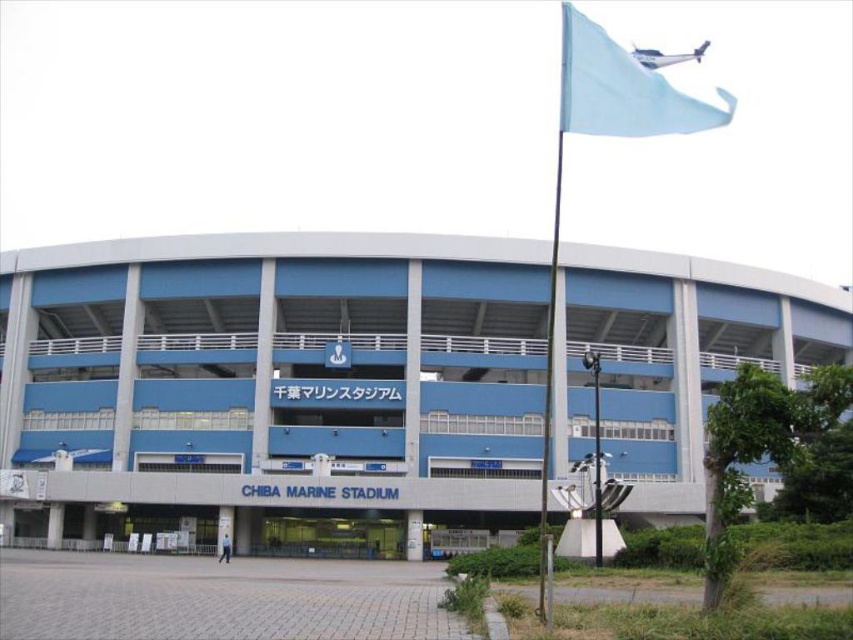
Looking at this image, you are a photographer planning to capture the entire Chiba Marine Stadium and the flag in one shot. Given that your camera can only focus on objects within a 100m width, will the blue concrete stadium at center and the light blue fabric flag at upper right fit in the frame?

The blue concrete stadium at center is wider than the light blue fabric flag at upper right. Since the camera can focus on objects within a 100m width, both objects will fit as long as the total width of the stadium and flag combined does not exceed 100m. However, the description only provides a comparison of their widths, not their exact measurements. Without knowing the exact width of the stadium, it is impossible to determine if they will fit within the 100m limit.

You are standing at the entrance of Chiba Marine Stadium and notice a light blue fabric flag at upper right. Based on its coordinates, can you determine if it is positioned higher up or lower down relative to the entrance steps?

The light blue fabric flag at upper right is located at point (622, 90), which indicates it is positioned higher up relative to the entrance steps.